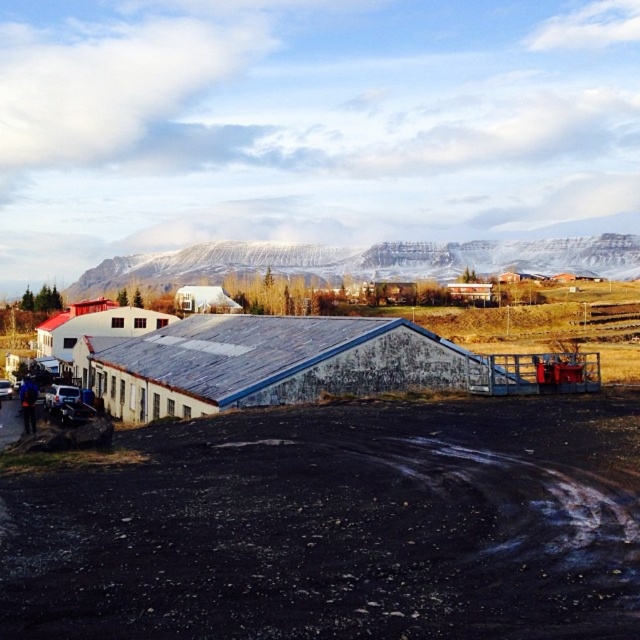
Can you confirm if black gravel dirt track at lower left is taller than snowy rock formation at upper center?

No.

Is black gravel dirt track at lower left to the left of snowy rock formation at upper center from the viewer's perspective?

Correct, you'll find black gravel dirt track at lower left to the left of snowy rock formation at upper center.

Is point (244, 554) more distant than point (461, 262)?

No, (244, 554) is closer to viewer.

Locate an element on the screen. The height and width of the screenshot is (640, 640). black gravel dirt track at lower left is located at coordinates (339, 525).